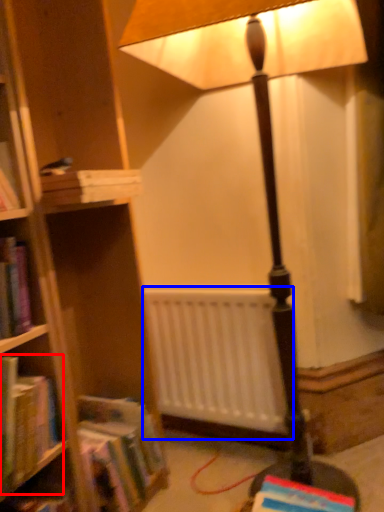
Question: Which object appears farthest to the camera in this image, book (highlighted by a red box) or radiator (highlighted by a blue box)?

Choices:
 (A) book
 (B) radiator

Answer: (B)